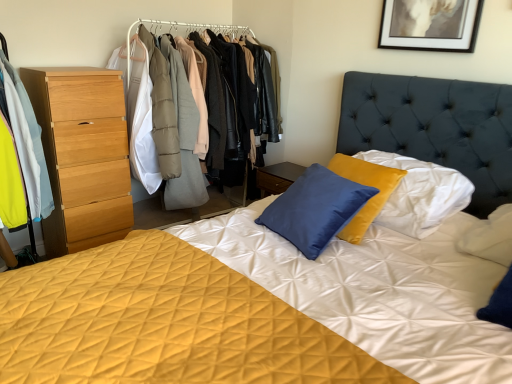
Question: Can you confirm if wooden dresser at left is taller than light blue fabric coat at left?

Choices:
 (A) yes
 (B) no

Answer: (A)

Question: Can you see wooden dresser at left touching light blue fabric coat at left?

Choices:
 (A) yes
 (B) no

Answer: (B)

Question: Can you confirm if wooden dresser at left is smaller than light blue fabric coat at left?

Choices:
 (A) yes
 (B) no

Answer: (B)

Question: Is wooden dresser at left oriented away from light blue fabric coat at left?

Choices:
 (A) no
 (B) yes

Answer: (A)

Question: Does wooden dresser at left have a greater width compared to light blue fabric coat at left?

Choices:
 (A) yes
 (B) no

Answer: (B)

Question: In the image, is black matte picture frame at upper center positioned in front of or behind light blue fabric coat at left?

Choices:
 (A) behind
 (B) front

Answer: (A)

Question: Is black matte picture frame at upper center taller or shorter than light blue fabric coat at left?

Choices:
 (A) short
 (B) tall

Answer: (A)

Question: Based on their sizes in the image, would you say black matte picture frame at upper center is bigger or smaller than light blue fabric coat at left?

Choices:
 (A) small
 (B) big

Answer: (A)

Question: Visually, is black matte picture frame at upper center positioned to the left or to the right of light blue fabric coat at left?

Choices:
 (A) right
 (B) left

Answer: (A)

Question: From the image's perspective, relative to wooden dresser at left, is light blue fabric coat at left above or below?

Choices:
 (A) below
 (B) above

Answer: (A)

Question: Looking at the image, does light blue fabric coat at left seem bigger or smaller compared to wooden dresser at left?

Choices:
 (A) small
 (B) big

Answer: (A)

Question: Considering the relative positions of light blue fabric coat at left and wooden dresser at left in the image provided, is light blue fabric coat at left to the left or to the right of wooden dresser at left?

Choices:
 (A) left
 (B) right

Answer: (A)

Question: Is light blue fabric coat at left wider or thinner than wooden dresser at left?

Choices:
 (A) thin
 (B) wide

Answer: (B)

Question: In the image, is wooden dresser at left positioned in front of or behind light blue fabric coat at left?

Choices:
 (A) front
 (B) behind

Answer: (B)

Question: From a real-world perspective, is wooden dresser at left positioned above or below light blue fabric coat at left?

Choices:
 (A) above
 (B) below

Answer: (B)